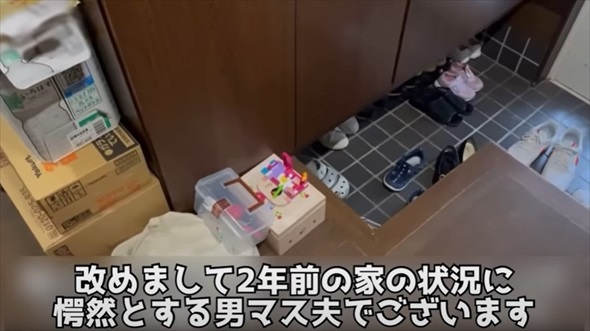
The image size is (590, 331). I want to click on brown cardboard box, so click(x=93, y=240), click(x=68, y=187).